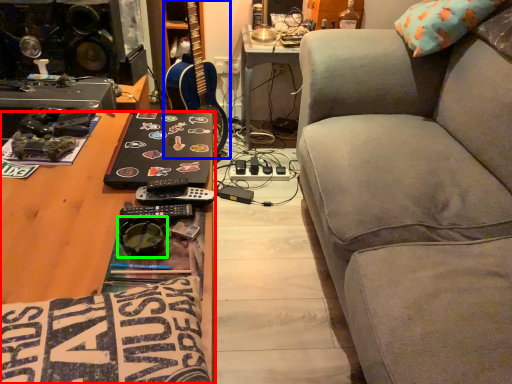
Question: Which object is the farthest from desk (highlighted by a red box)? Choose among these: guitar (highlighted by a blue box) or goggles (highlighted by a green box).

Choices:
 (A) guitar
 (B) goggles

Answer: (A)